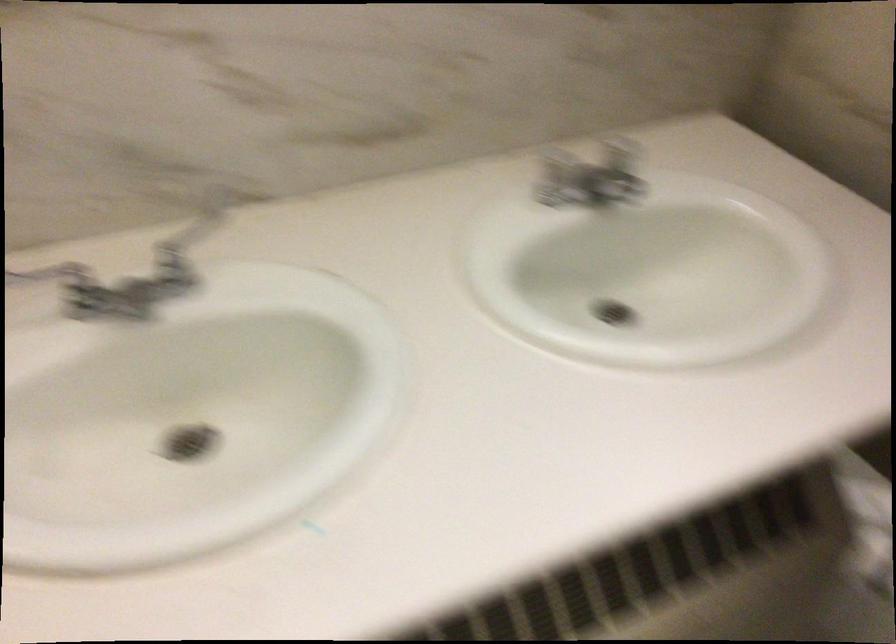
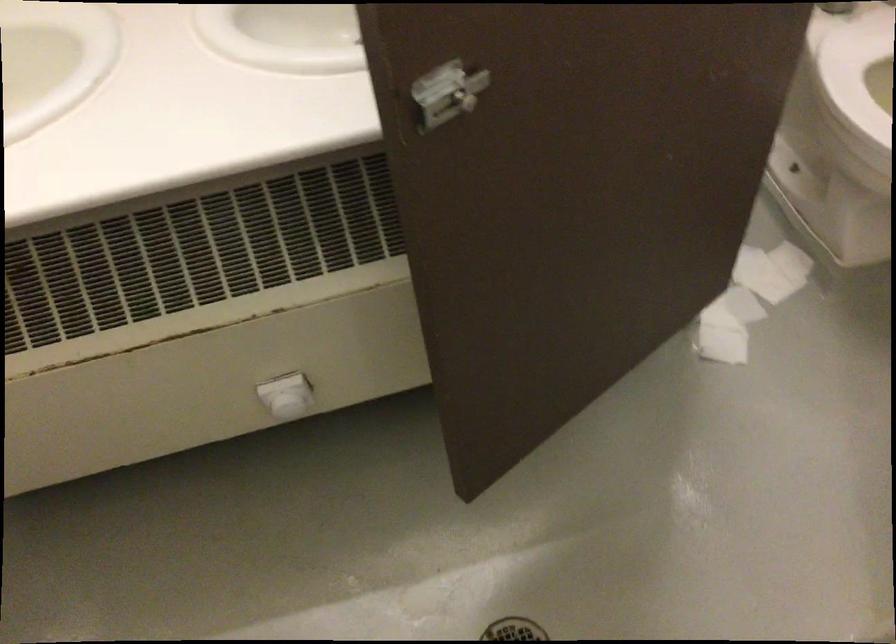
Question: How did the camera likely rotate?

Choices:
 (A) Left
 (B) Right
 (C) Up
 (D) Down

Answer: (D)